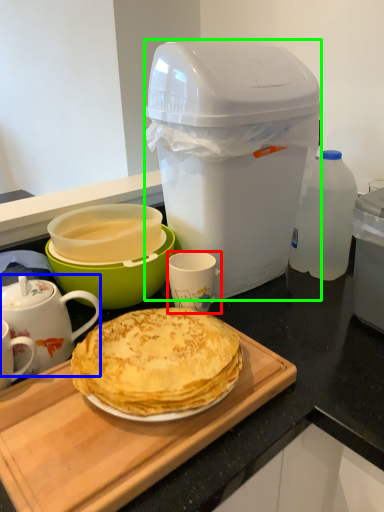
Question: Which is farther away from coffee cup (highlighted by a red box)? teapot (highlighted by a blue box) or trash bin/can (highlighted by a green box)?

Choices:
 (A) teapot
 (B) trash bin/can

Answer: (B)